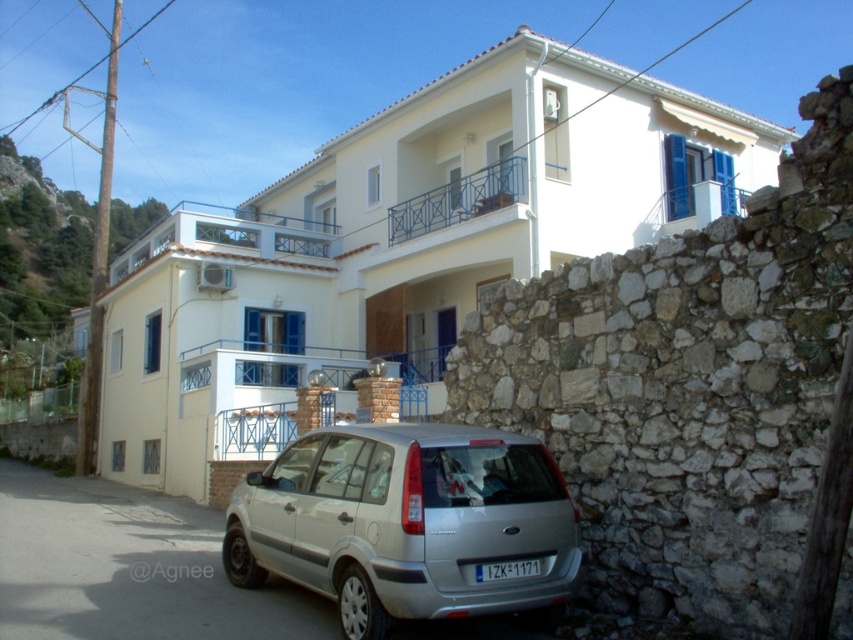
Does silver metallic hatchback at lower center have a greater height compared to black plastic license plate at lower center?

Yes.

Is silver metallic hatchback at lower center positioned before black plastic license plate at lower center?

Yes, it is.

Find the location of `silver metallic hatchback at lower center`. silver metallic hatchback at lower center is located at coordinates (408, 524).

Locate an element on the screen. The height and width of the screenshot is (640, 853). silver metallic hatchback at lower center is located at coordinates (408, 524).

Can you confirm if white painted villa at center is positioned to the left of black plastic license plate at lower center?

Yes, white painted villa at center is to the left of black plastic license plate at lower center.

Can you confirm if white painted villa at center is positioned to the right of black plastic license plate at lower center?

No, white painted villa at center is not to the right of black plastic license plate at lower center.

Between point (251, 266) and point (526, 572), which one is positioned in front?

Point (526, 572)

What are the coordinates of `white painted villa at center` in the screenshot? It's located at (399, 244).

Does white painted villa at center appear on the left side of silver metallic hatchback at lower center?

Indeed, white painted villa at center is positioned on the left side of silver metallic hatchback at lower center.

Can you confirm if white painted villa at center is thinner than silver metallic hatchback at lower center?

In fact, white painted villa at center might be wider than silver metallic hatchback at lower center.

Which is behind, point (335, 266) or point (376, 632)?

Point (335, 266)

In order to click on white painted villa at center in this screenshot , I will do `click(399, 244)`.